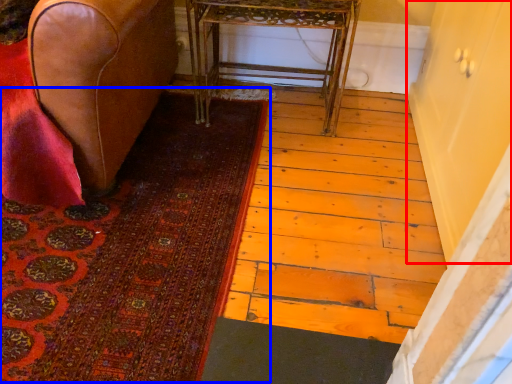
Question: Which of the following is the closest to the observer, screen door (highlighted by a red box) or mat (highlighted by a blue box)?

Choices:
 (A) screen door
 (B) mat

Answer: (A)